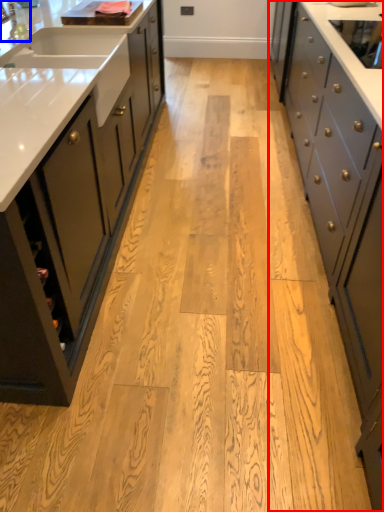
Question: Which object is further to the camera taking this photo, cabinetry (highlighted by a red box) or faucet (highlighted by a blue box)?

Choices:
 (A) cabinetry
 (B) faucet

Answer: (B)